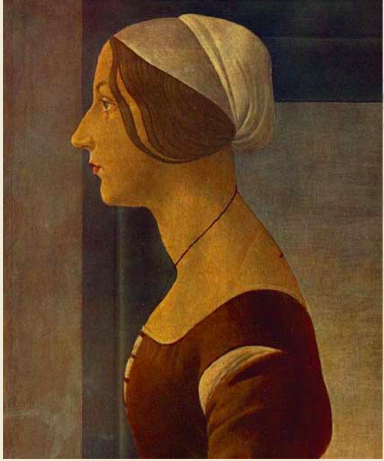
This screenshot has width=384, height=461. What are the coordinates of `wood for window frame` in the screenshot? It's located at (321, 66).